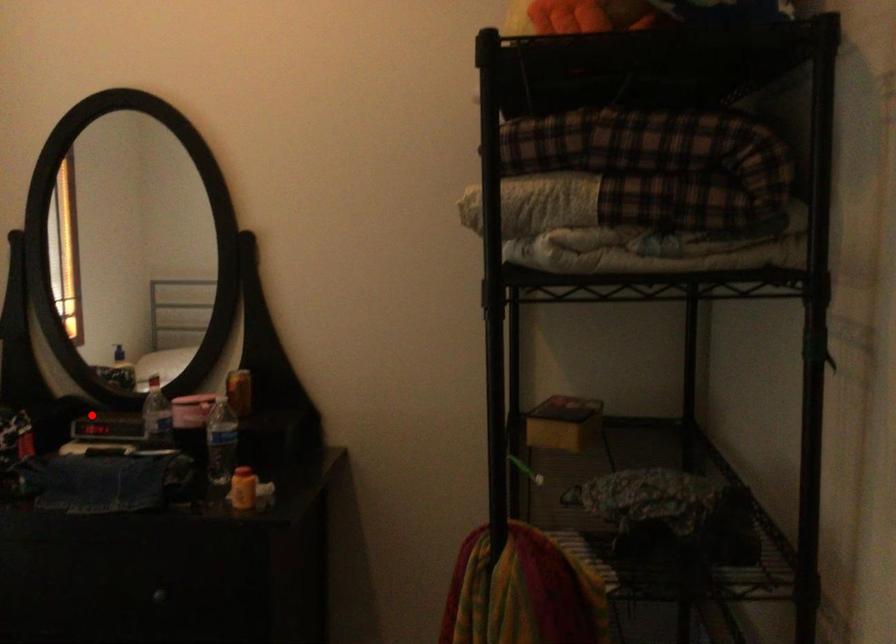
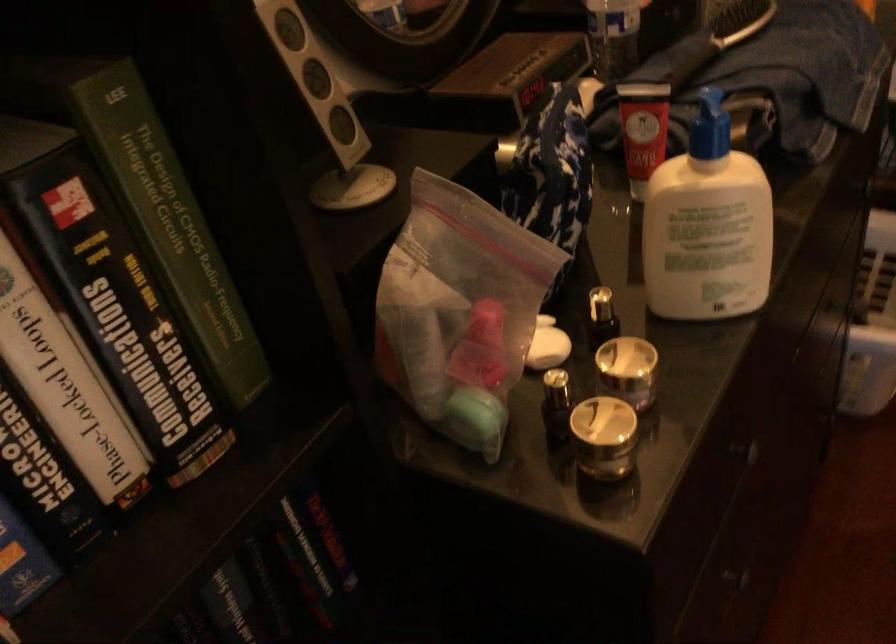
Question: I am providing you with two images of the same scene from different viewpoints. Image1 has a red point marked. In image2, the corresponding 3D location appears at what relative position? Reply with the corresponding letter.

Choices:
 (A) Closer
 (B) Farther

Answer: (A)